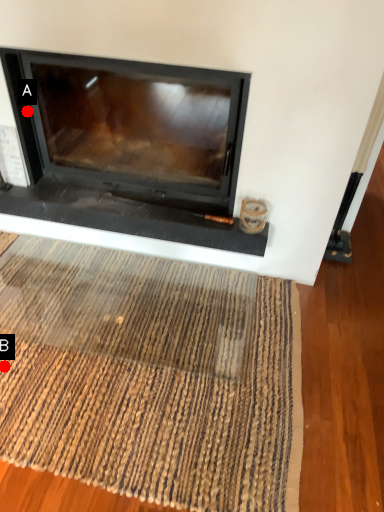
Question: Two points are circled on the image, labeled by A and B beside each circle. Which point is closer to the camera?

Choices:
 (A) A is closer
 (B) B is closer

Answer: (B)